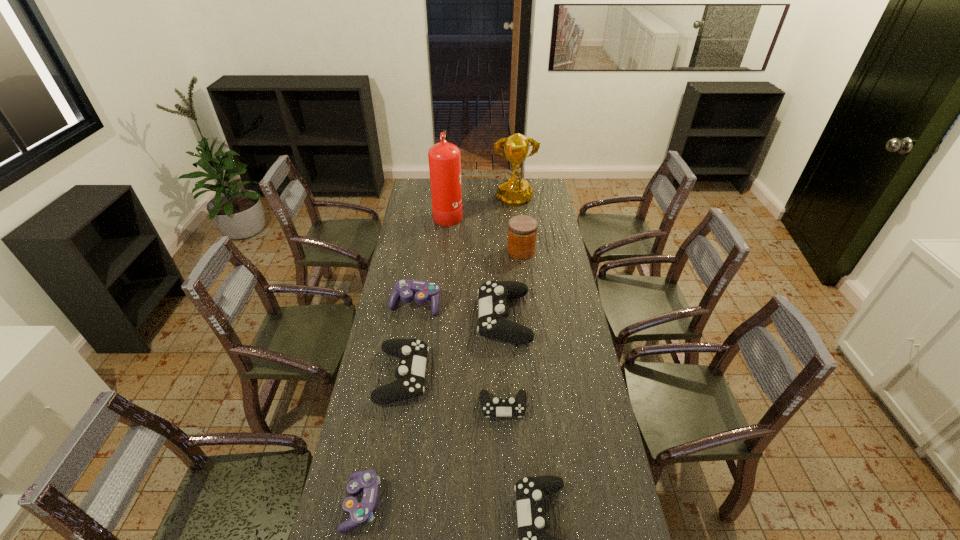
Where is `blank area in the image that satisfies the following two spatial constraints: 1. on the front side of the third farthest object; 2. on the left side of the award`? The image size is (960, 540). blank area in the image that satisfies the following two spatial constraints: 1. on the front side of the third farthest object; 2. on the left side of the award is located at coordinates (519, 251).